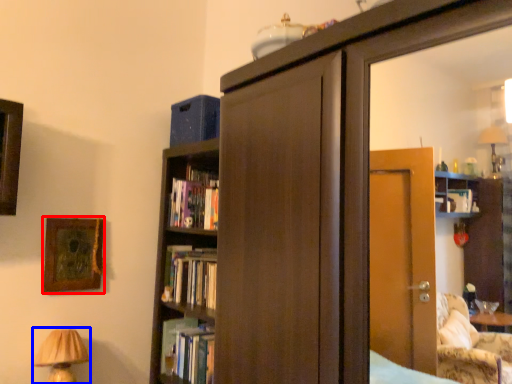
Question: Which object is further to the camera taking this photo, picture frame (highlighted by a red box) or table lamp (highlighted by a blue box)?

Choices:
 (A) picture frame
 (B) table lamp

Answer: (A)